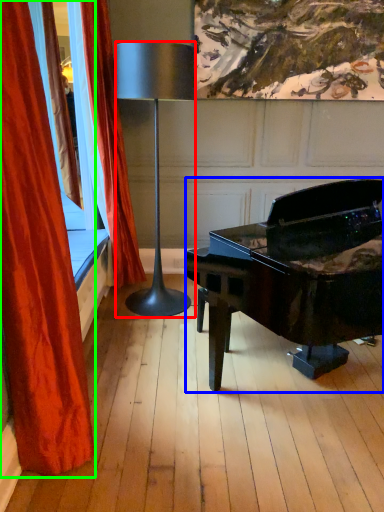
Question: Estimate the real-world distances between objects in this image. Which object is closer to lamp (highlighted by a red box), piano (highlighted by a blue box) or curtain (highlighted by a green box)?

Choices:
 (A) piano
 (B) curtain

Answer: (A)